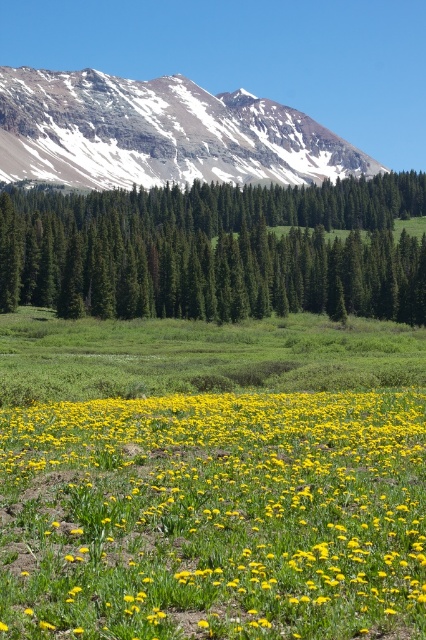
Question: Which point is farther to the camera?

Choices:
 (A) snowy rocky mountain at upper left
 (B) green matte tree at center

Answer: (A)

Question: Which point is farther to the camera?

Choices:
 (A) (249, 250)
 (B) (17, 141)

Answer: (B)

Question: Does yellow matte flower at center appear over snowy rocky mountain at upper left?

Choices:
 (A) yes
 (B) no

Answer: (B)

Question: Which object is closer to the camera taking this photo?

Choices:
 (A) green matte tree at center
 (B) yellow matte flower at center
 (C) snowy rocky mountain at upper left

Answer: (B)

Question: Does yellow matte flower at center have a smaller size compared to snowy rocky mountain at upper left?

Choices:
 (A) yes
 (B) no

Answer: (A)

Question: Is yellow matte flower at center closer to the viewer compared to snowy rocky mountain at upper left?

Choices:
 (A) yes
 (B) no

Answer: (A)